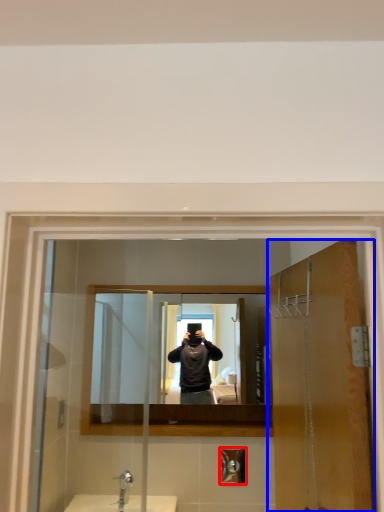
Question: Which of the following is the farthest to the observer, shower (highlighted by a red box) or door (highlighted by a blue box)?

Choices:
 (A) shower
 (B) door

Answer: (A)